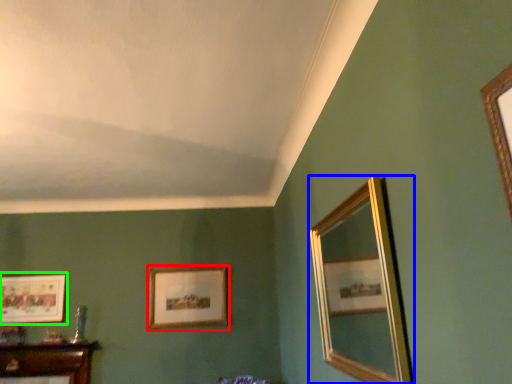
Question: Estimate the real-world distances between objects in this image. Which object is closer to picture frame (highlighted by a red box), mirror (highlighted by a blue box) or picture frame (highlighted by a green box)?

Choices:
 (A) mirror
 (B) picture frame

Answer: (B)